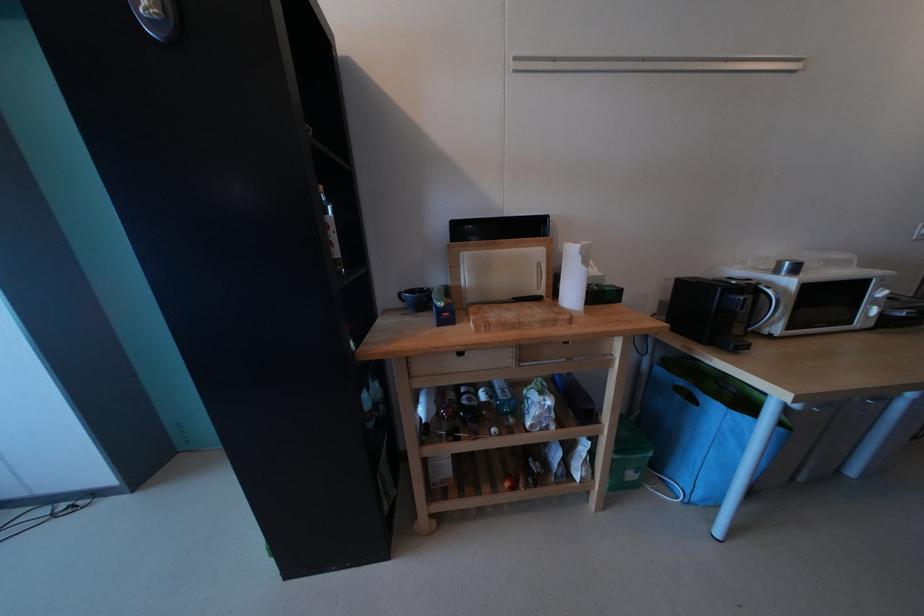
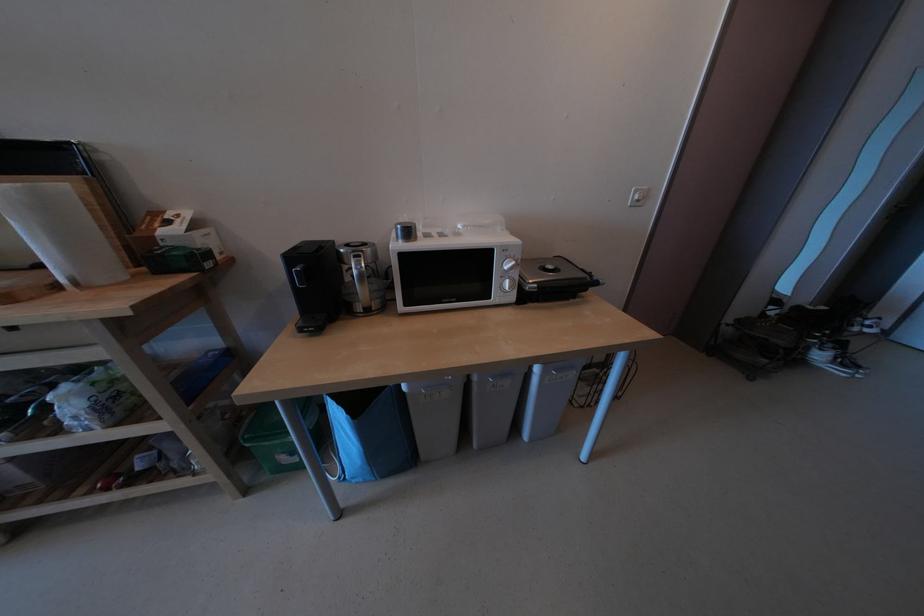
Question: What movement of the cameraman would produce the second image?

Choices:
 (A) Left
 (B) Right
 (C) Forward
 (D) Backward

Answer: (B)